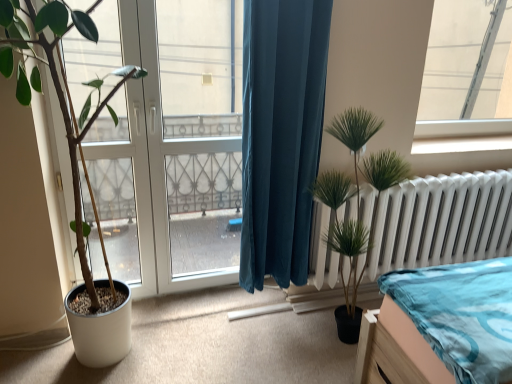
The image size is (512, 384). Find the location of `free space in front of transparent glass door at left`. free space in front of transparent glass door at left is located at coordinates (164, 340).